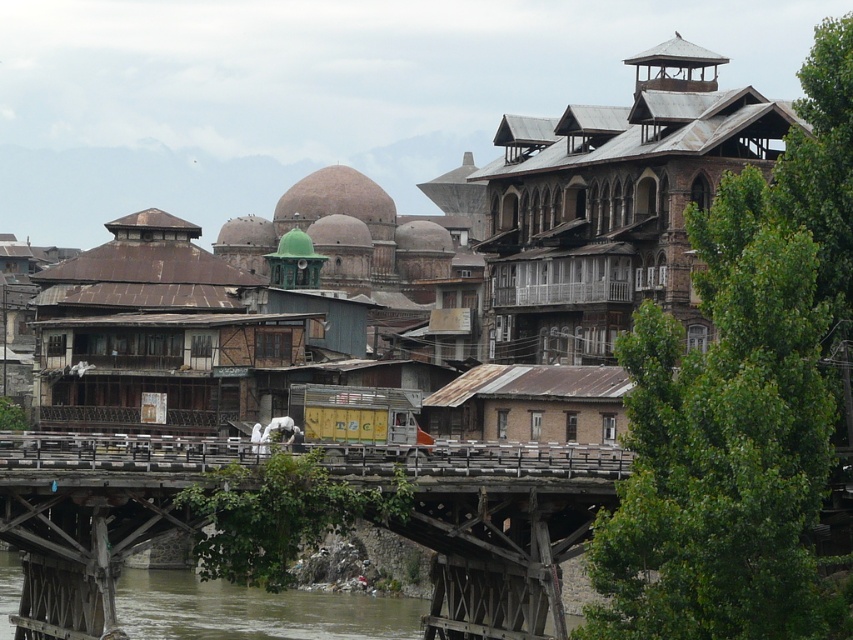
Who is taller, brown wooden building at upper right or rusty wood balcony at left?

Standing taller between the two is brown wooden building at upper right.

Which is in front, point (670, 292) or point (263, 278)?

Point (670, 292) is in front.

Where is `brown wooden building at upper right`? brown wooden building at upper right is located at coordinates [612, 204].

Who is more forward, (502, 509) or (3, 582)?

Point (502, 509) is more forward.

Is point (73, 632) less distant than point (230, 620)?

Yes, it is.

Where is `wooden bridge at center`? wooden bridge at center is located at coordinates (496, 525).

The height and width of the screenshot is (640, 853). Identify the location of wooden bridge at center. (496, 525).

Can you confirm if rustic wooden bridge at center is bigger than wooden bridge at center?

Indeed, rustic wooden bridge at center has a larger size compared to wooden bridge at center.

Does rustic wooden bridge at center appear under wooden bridge at center?

No.

Locate an element on the screen. This screenshot has height=640, width=853. rustic wooden bridge at center is located at coordinates (537, 220).

The height and width of the screenshot is (640, 853). Find the location of `rustic wooden bridge at center`. rustic wooden bridge at center is located at coordinates (537, 220).